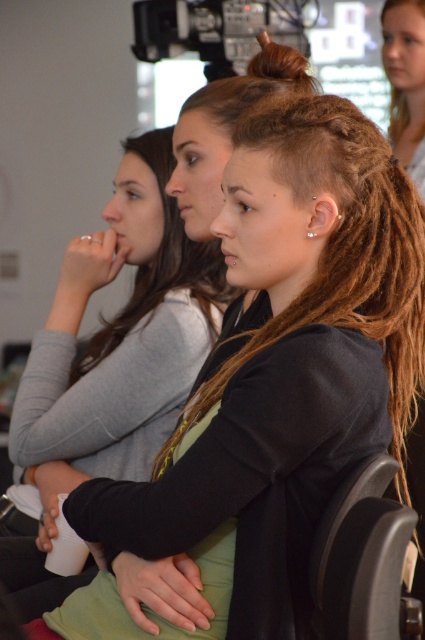
In the classroom scene, there are three women in the foreground. The first woman has reddish brown dreadlocks and is wearing a black jacket over a green top. The second woman has long brown hair and is wearing a gray long sleeved shirt. The third woman is not described. A point at coordinate (342, 248) is present. Which object is the point located on?

The point at coordinate (342, 248) is located on the brown dreadlocks at center belonging to the first woman.